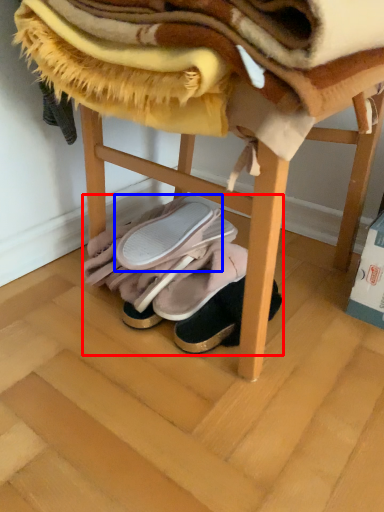
Question: Which object is further to the camera taking this photo, footwear (highlighted by a red box) or footwear (highlighted by a blue box)?

Choices:
 (A) footwear
 (B) footwear

Answer: (A)